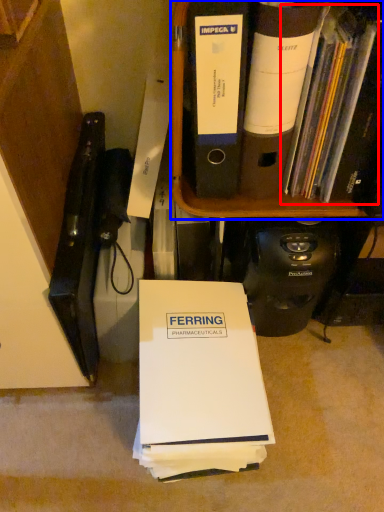
Question: Which of the following is the closest to the observer, book (highlighted by a red box) or bookcase (highlighted by a blue box)?

Choices:
 (A) book
 (B) bookcase

Answer: (A)